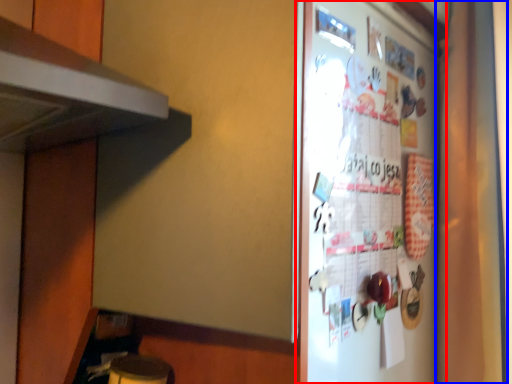
Question: Which object appears closest to the camera in this image, refrigerator (highlighted by a red box) or curtain (highlighted by a blue box)?

Choices:
 (A) refrigerator
 (B) curtain

Answer: (A)